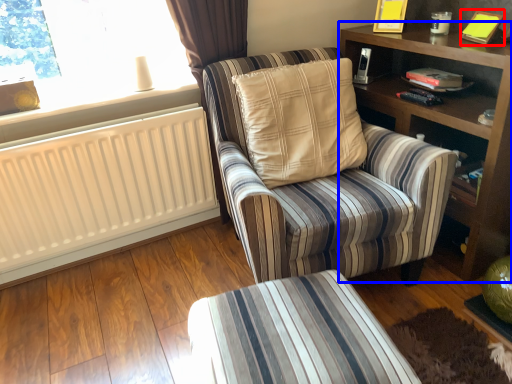
Question: Among these objects, which one is nearest to the camera, book (highlighted by a red box) or shelf (highlighted by a blue box)?

Choices:
 (A) book
 (B) shelf

Answer: (B)